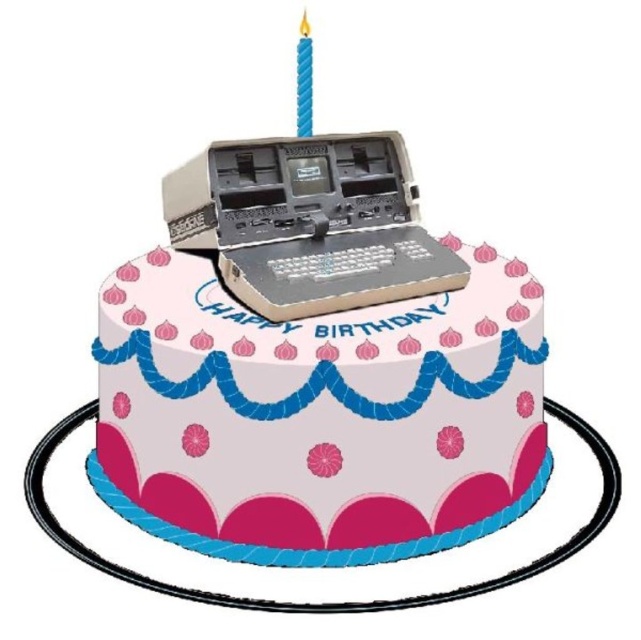
Consider the image. You are a baker who wants to place a blue wax candle at upper center on top of the white matte cake at center. Can you determine if the candle will fit on the cake?

The white matte cake at center might be wider than blue wax candle at upper center, so there is a possibility that the candle will fit, but it is uncertain without exact measurements.